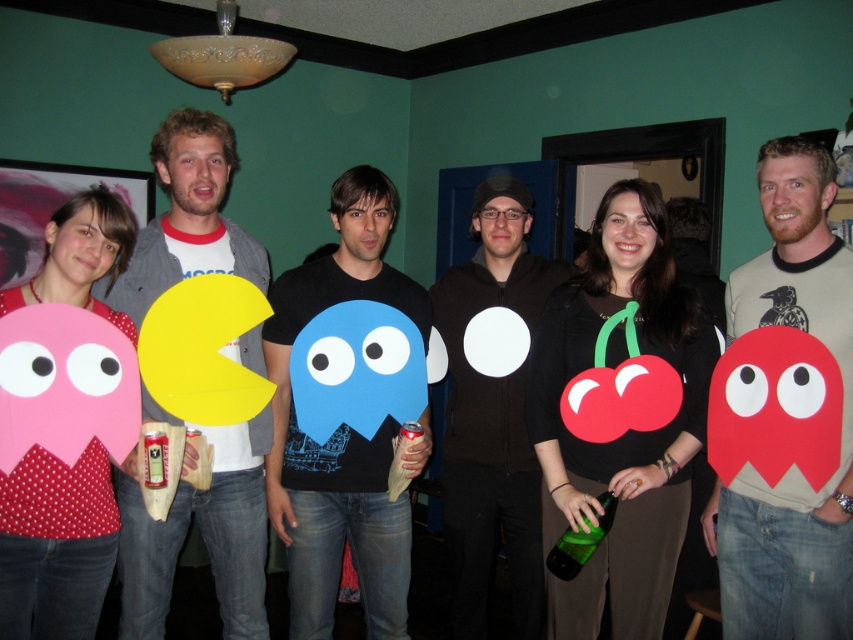
Question: Does blue matte t-shirt at center have a lesser width compared to matte yellow paper at left?

Choices:
 (A) no
 (B) yes

Answer: (A)

Question: Which point is closer to the camera taking this photo?

Choices:
 (A) [x=459, y=432]
 (B) [x=778, y=296]
 (C) [x=393, y=420]
 (D) [x=122, y=636]

Answer: (D)

Question: Which of the following is the farthest from the observer?

Choices:
 (A) black matte circle at center
 (B) matte yellow paper at left
 (C) blue matte t-shirt at center

Answer: (A)

Question: Which of the following is the closest to the observer?

Choices:
 (A) matte yellow paper at left
 (B) matte gray t-shirt at center
 (C) blue matte t-shirt at center
 (D) black matte circle at center

Answer: (B)

Question: Does matte yellow paper at left have a greater width compared to black matte circle at center?

Choices:
 (A) yes
 (B) no

Answer: (B)

Question: Is matte gray t-shirt at center above blue matte t-shirt at center?

Choices:
 (A) no
 (B) yes

Answer: (B)